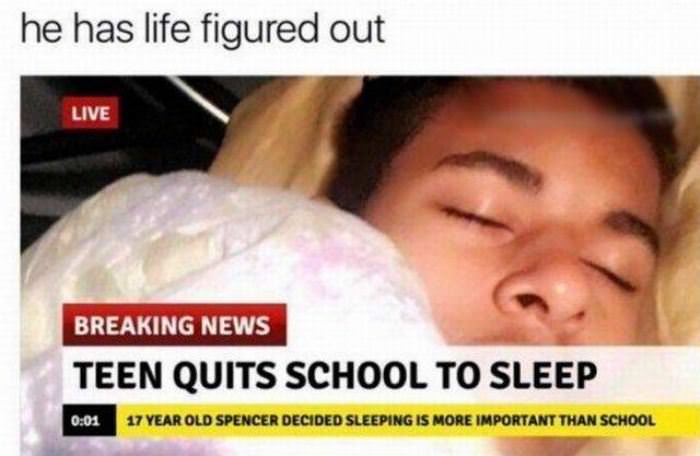
Locate an element on the screen. The width and height of the screenshot is (700, 456). blanket is located at coordinates (110, 214), (105, 289), (340, 309), (266, 221), (189, 271).